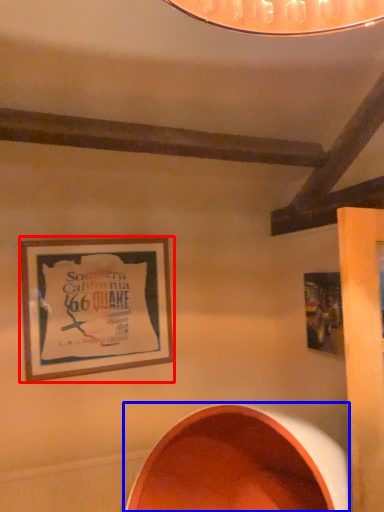
Question: Which point is further to the camera, picture frame (highlighted by a red box) or oval (highlighted by a blue box)?

Choices:
 (A) picture frame
 (B) oval

Answer: (A)